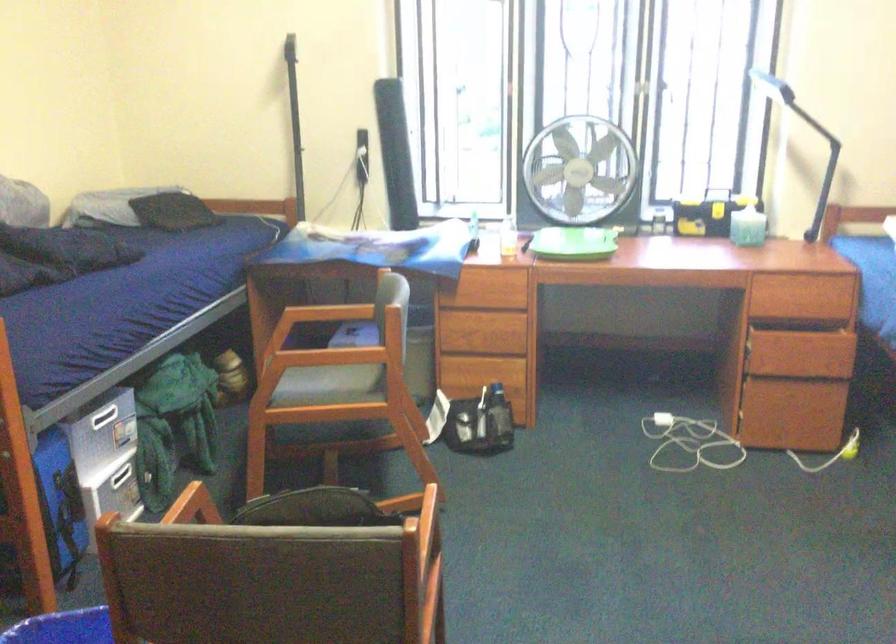
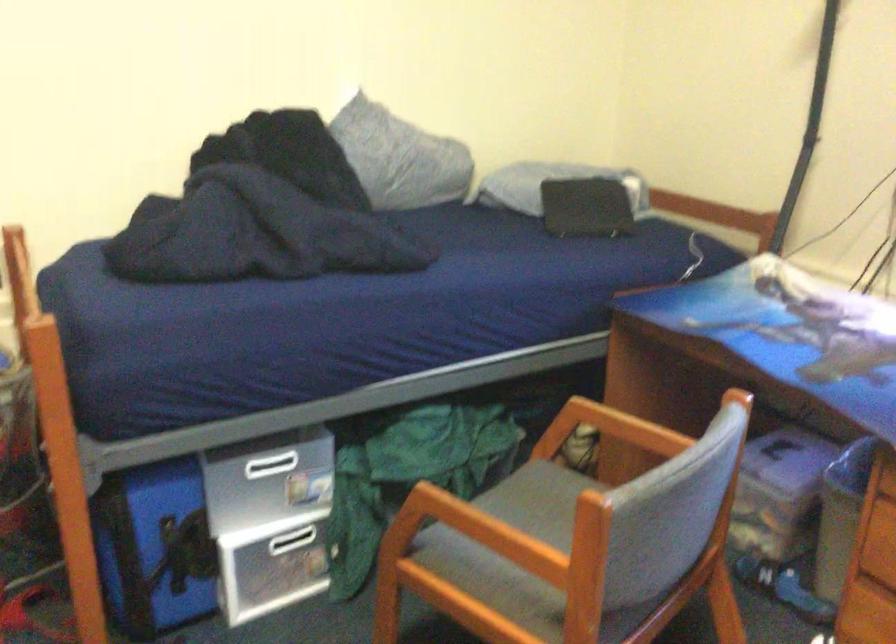
In the second image, find the point that corresponds to pixel 92 420 in the first image.

(270, 465)